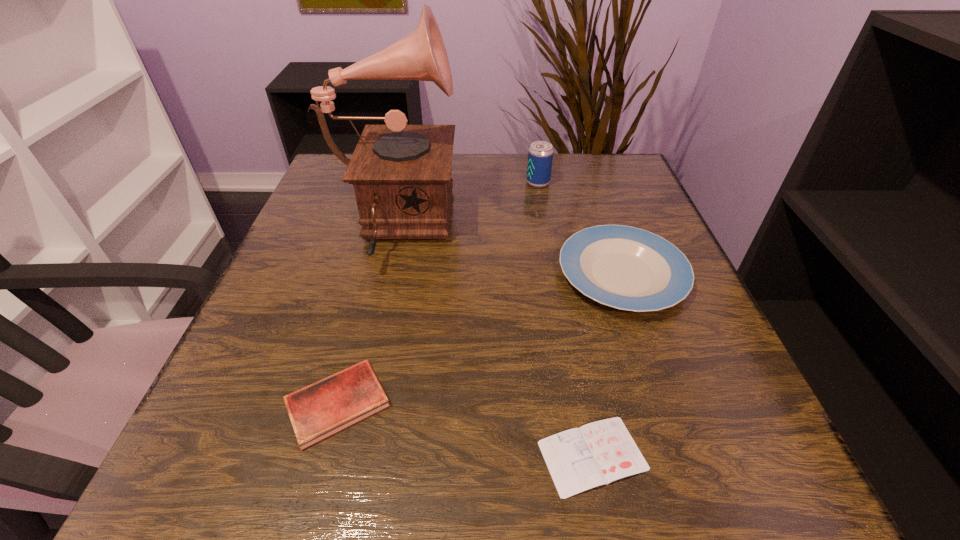
The image size is (960, 540). I want to click on free location located on the left of the second shortest object, so click(250, 403).

Locate an element on the screen. This screenshot has width=960, height=540. vacant space situated 0.080m on the right of the shorter diary is located at coordinates (707, 456).

Locate an element on the screen. This screenshot has width=960, height=540. record player that is at the far edge is located at coordinates (401, 174).

This screenshot has height=540, width=960. What are the coordinates of `beer can present at the far edge` in the screenshot? It's located at (540, 156).

This screenshot has height=540, width=960. Find the location of `record player present at the left edge`. record player present at the left edge is located at coordinates (401, 174).

Locate an element on the screen. The width and height of the screenshot is (960, 540). diary situated at the left edge is located at coordinates (317, 411).

The image size is (960, 540). I want to click on object that is at the right edge, so click(627, 268).

You are a GUI agent. You are given a task and a screenshot of the screen. Output one action in this format:
    pyautogui.click(x=<x>, y=<y>)
    Task: Click on the object that is at the far left corner
    
    Given the screenshot: What is the action you would take?
    point(401,174)

Where is `object present at the near left corner`? This screenshot has height=540, width=960. object present at the near left corner is located at coordinates (317, 411).

You are a GUI agent. You are given a task and a screenshot of the screen. Output one action in this format:
    pyautogui.click(x=<x>, y=<y>)
    Task: Click on the vacant space at the far edge
    
    Given the screenshot: What is the action you would take?
    pyautogui.click(x=516, y=171)